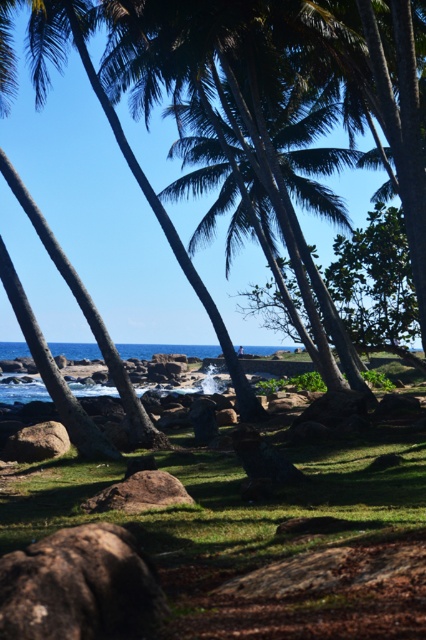
You are standing at the beach looking towards the ocean. There are two points marked on the image. The first is point (x=186, y=522) and the second is point (x=97, y=390). Which point is closer to you?

Point (x=97, y=390) is closer to you because it is behind point (x=186, y=522).

You are standing at the center of the image and want to place a small flag exactly at the location of the green grass at center. According to the coordinates provided, what are the exact coordinates where you should place the flag?

The exact coordinates to place the flag at the green grass at center are point (232, 499).

You are standing at the point marked by point (232, 499) and want to walk towards the nearest palm tree. Which direction should you head?

The point (232, 499) is located at the green grass at center. Since the palm trees are in the foreground and dominate the view, they are closest to the viewer. Therefore, to reach the nearest palm tree, you should walk forward towards the foreground where the palm trees are situated.